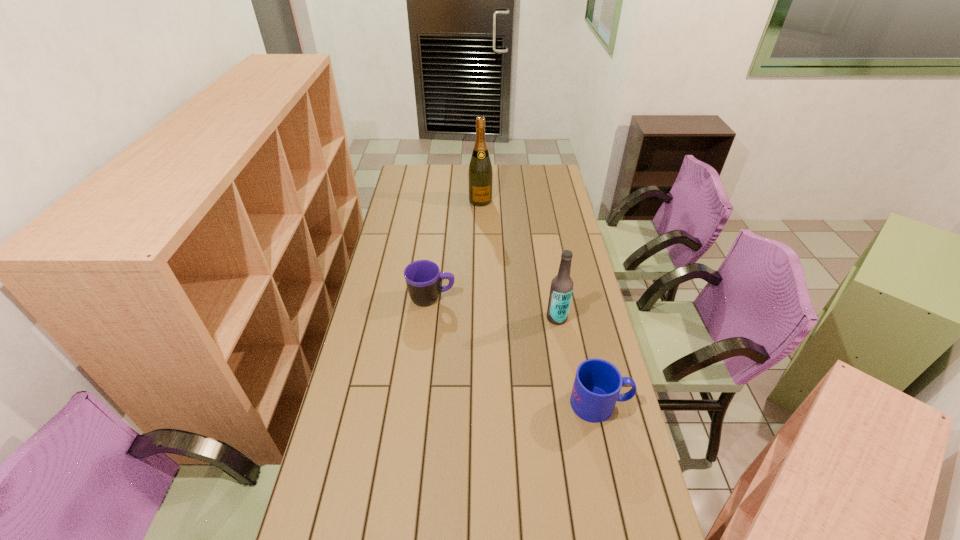
Find the location of a particular element. free spot on the desktop that is between the farther mug and the right mug and is positioned on the label of the beer bottle is located at coordinates (509, 346).

You are a GUI agent. You are given a task and a screenshot of the screen. Output one action in this format:
    pyautogui.click(x=<x>, y=<y>)
    Task: Click on the vacant space on the desktop that is between the left mug and the nearer mug and is positioned on the front-facing side of the tallest object
    The width and height of the screenshot is (960, 540).
    Given the screenshot: What is the action you would take?
    pyautogui.click(x=517, y=352)